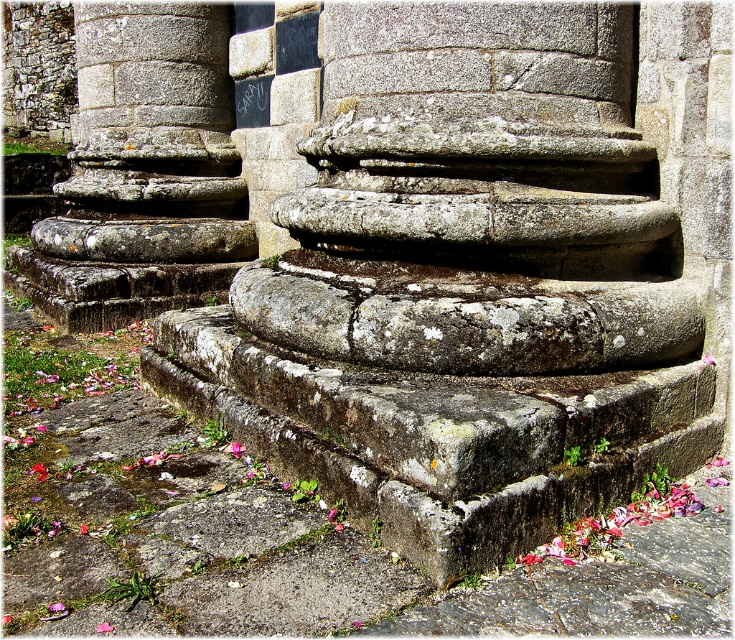
Can you confirm if gray stone stairs at center is taller than granite steps at center?

Incorrect, gray stone stairs at center's height is not larger of granite steps at center's.

Measure the distance between gray stone stairs at center and granite steps at center.

gray stone stairs at center is 2.74 meters from granite steps at center.

Who is more distant from viewer, (344, 8) or (104, 44)?

Positioned behind is point (104, 44).

The width and height of the screenshot is (735, 640). What are the coordinates of `gray stone stairs at center` in the screenshot? It's located at (462, 289).